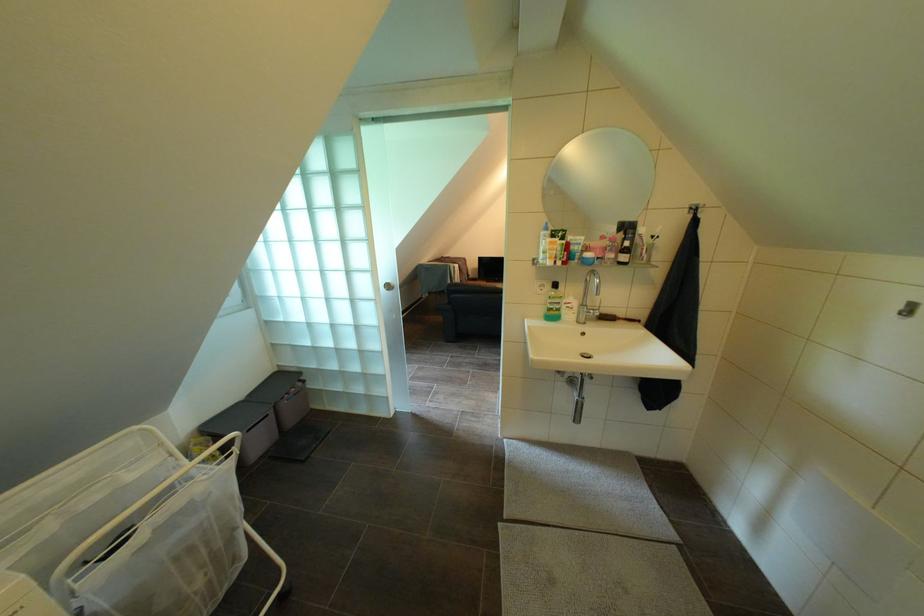
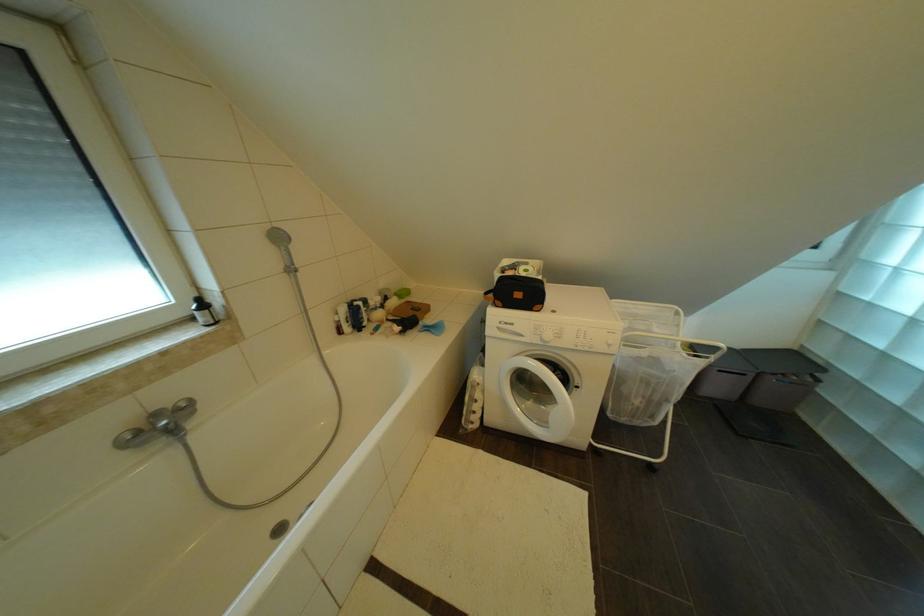
The first image is from the beginning of the video and the second image is from the end. How did the camera likely rotate when shooting the video?

The camera's rotation is toward left-down.